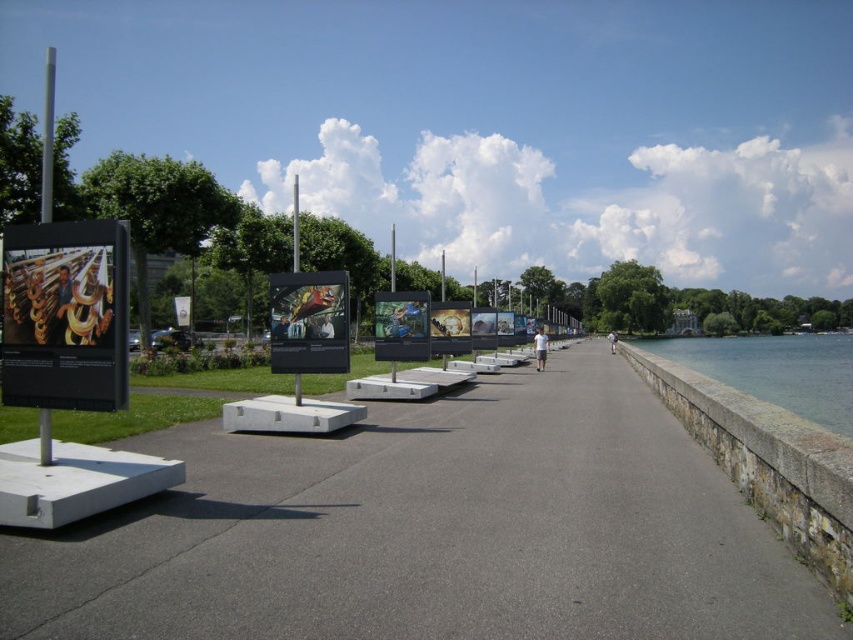
Question: Does gray concrete path at center appear over white cotton shirt at center?

Choices:
 (A) no
 (B) yes

Answer: (A)

Question: Is gray concrete path at center to the right of white fabric person at center from the viewer's perspective?

Choices:
 (A) yes
 (B) no

Answer: (B)

Question: Which of the following is the farthest from the observer?

Choices:
 (A) white cotton shirt at center
 (B) metallic reflective poster at center
 (C) white fabric person at center

Answer: (C)

Question: Which point is farther from the camera taking this photo?

Choices:
 (A) (845, 362)
 (B) (103, 316)

Answer: (A)

Question: Does metallic reflective poster at center have a lesser width compared to white cotton shirt at center?

Choices:
 (A) yes
 (B) no

Answer: (B)

Question: Which object is farther from the camera taking this photo?

Choices:
 (A) gray stone wall at right
 (B) white fabric person at center
 (C) white cotton shirt at center
 (D) matte black sign at left

Answer: (B)